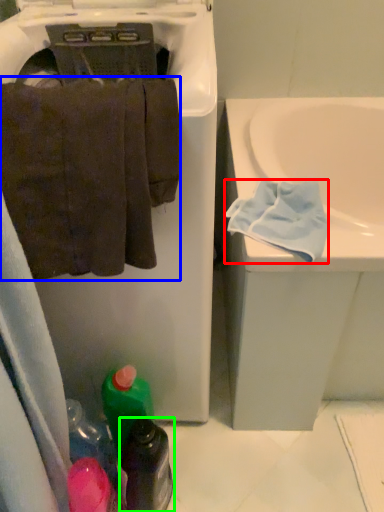
Question: Based on their relative distances, which object is nearer to bath towel (highlighted by a red box)? Choose from towel (highlighted by a blue box) and bottle (highlighted by a green box).

Choices:
 (A) towel
 (B) bottle

Answer: (A)